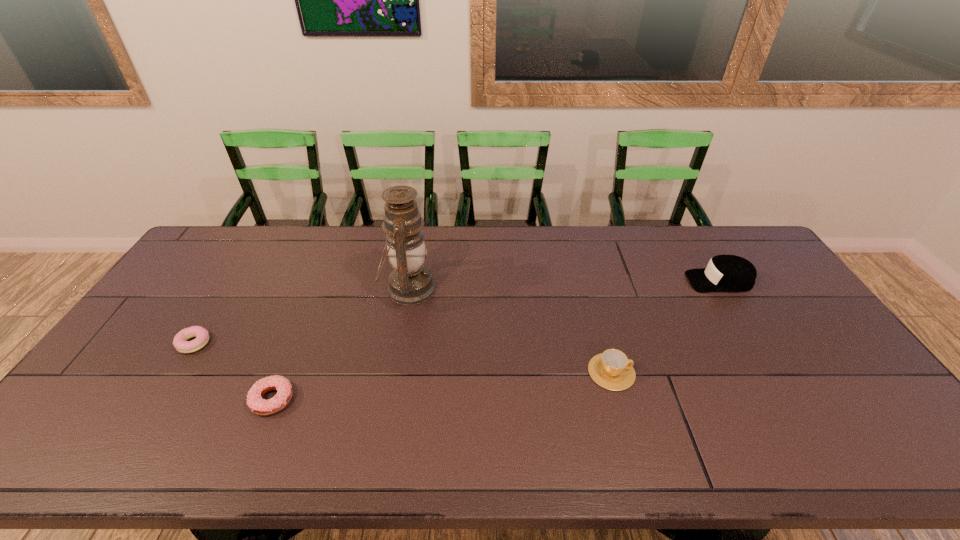
You are a GUI agent. You are given a task and a screenshot of the screen. Output one action in this format:
    pyautogui.click(x=<x>, y=<y>)
    Task: Click on the vacant space at the far edge of the desktop
    
    Given the screenshot: What is the action you would take?
    pyautogui.click(x=516, y=241)

What are the coordinates of `free space at the near edge of the desktop` in the screenshot? It's located at (210, 433).

Find the location of a particular element. The image size is (960, 540). vacant space at the right edge is located at coordinates (773, 309).

The width and height of the screenshot is (960, 540). I want to click on blank space at the far left corner of the desktop, so click(x=210, y=265).

In the image, there is a desktop. Identify the location of free space at the near left corner. (89, 460).

Find the location of `free space between the cup and the nearer doughnut`. free space between the cup and the nearer doughnut is located at coordinates (442, 386).

Find the location of a particular element. free space between the third object from left to right and the left doughnut is located at coordinates (301, 316).

Where is `empty space between the second object from left to right and the leftmost object`? empty space between the second object from left to right and the leftmost object is located at coordinates (233, 372).

Identify the location of free area in between the fourth object from right to left and the cap. (496, 340).

The width and height of the screenshot is (960, 540). Identify the location of vacant area between the cup and the fourth object from right to left. (442, 386).